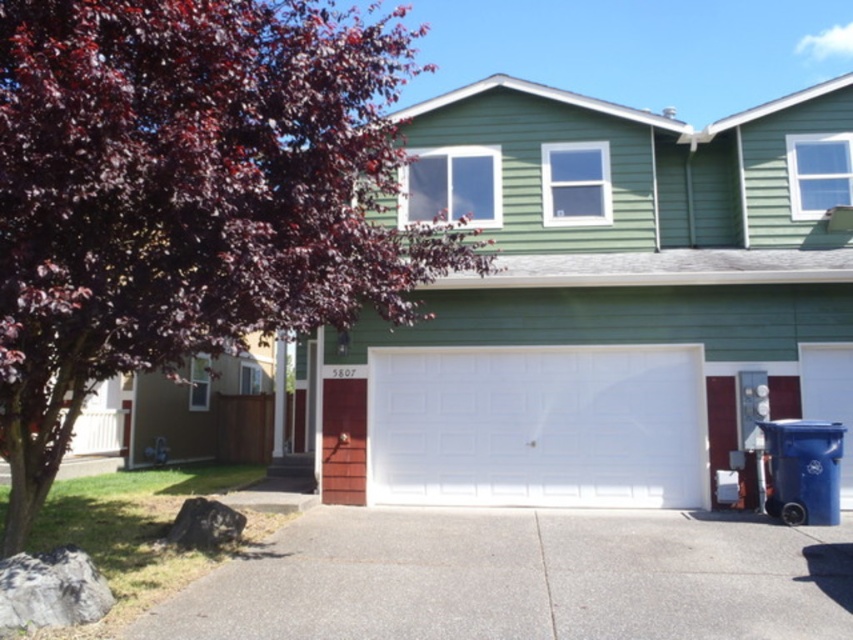
Question: Which point appears closest to the camera in this image?

Choices:
 (A) (474, 502)
 (B) (212, 344)
 (C) (486, 563)
 (D) (724, 296)

Answer: (B)

Question: Does white smooth garage door at center appear on the right side of gray concrete driveway at lower center?

Choices:
 (A) yes
 (B) no

Answer: (A)

Question: Does white smooth garage door at center appear over gray concrete driveway at lower center?

Choices:
 (A) no
 (B) yes

Answer: (B)

Question: Which object is farther from the camera taking this photo?

Choices:
 (A) gray concrete driveway at lower center
 (B) purple leafy tree at upper left
 (C) white smooth garage door at center

Answer: (C)

Question: Which object is positioned closest to the purple leafy tree at upper left?

Choices:
 (A) gray concrete driveway at lower center
 (B) white smooth garage door at center
 (C) white painted wood garage door at center

Answer: (A)

Question: Can you confirm if white smooth garage door at center is positioned to the left of purple leafy tree at upper left?

Choices:
 (A) no
 (B) yes

Answer: (A)